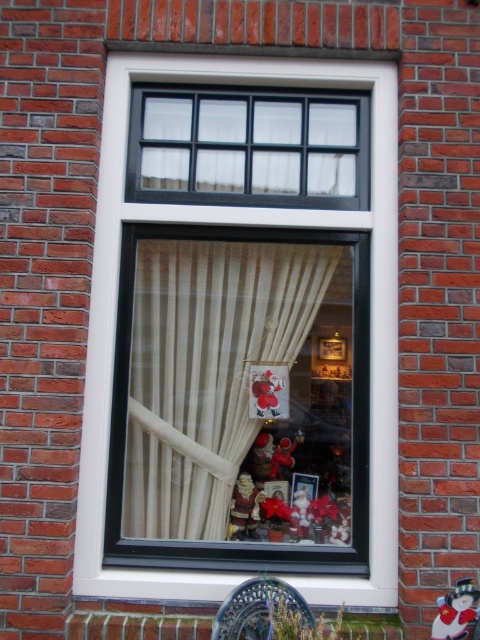
Is the position of matte red santa at lower right more distant than that of white matte santa at center?

That is False.

Who is more forward, (443, 602) or (295, 525)?

Positioned in front is point (443, 602).

Who is more forward, (x=439, y=618) or (x=302, y=538)?

Point (x=439, y=618)

The image size is (480, 640). I want to click on matte red santa at lower right, so click(x=456, y=611).

Can you confirm if white plastic window at center is smaller than white matte santa at center?

No.

What are the coordinates of `white plastic window at center` in the screenshot? It's located at (241, 224).

Between point (397, 433) and point (301, 490), which one is positioned behind?

Point (301, 490)

Find the location of a particular element. The width and height of the screenshot is (480, 640). white plastic window at center is located at coordinates (241, 224).

Does point (240, 513) lie in front of point (300, 499)?

Yes, it is.

Does matte brown figurine at center have a lesser width compared to white matte santa at center?

In fact, matte brown figurine at center might be wider than white matte santa at center.

Between point (244, 499) and point (301, 500), which one is positioned in front?

Point (301, 500) is in front.

Where is `matte brown figurine at center`? The image size is (480, 640). matte brown figurine at center is located at coordinates (243, 508).